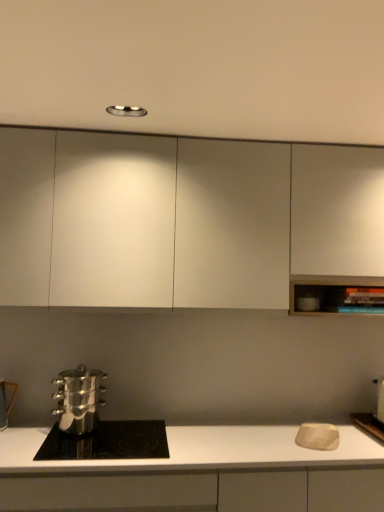
At what (x,y) coordinates should I click in order to perform the action: click on free space in front of polished stainless steel steamer at lower left. Please return your answer as a coordinate pair (x, y). Looking at the image, I should click on (65, 446).